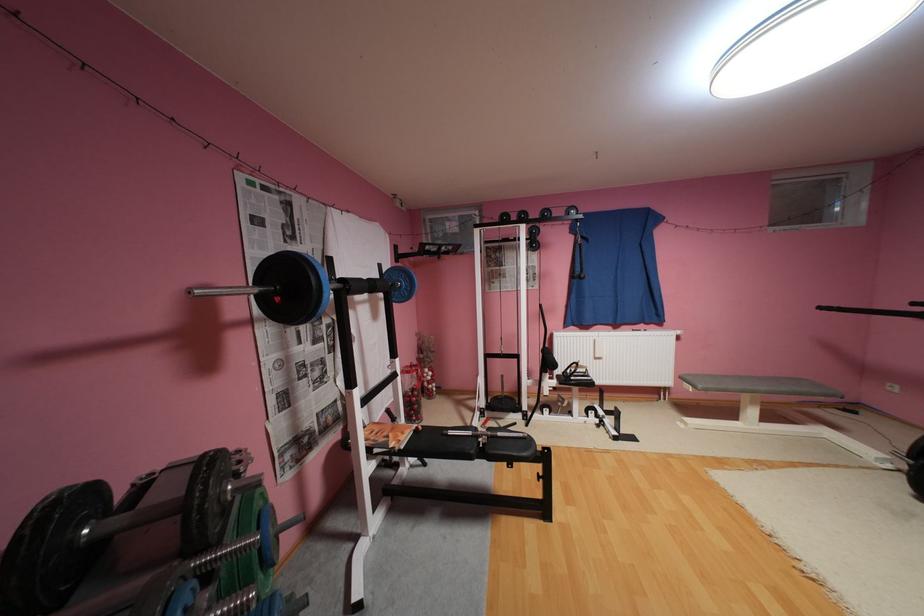
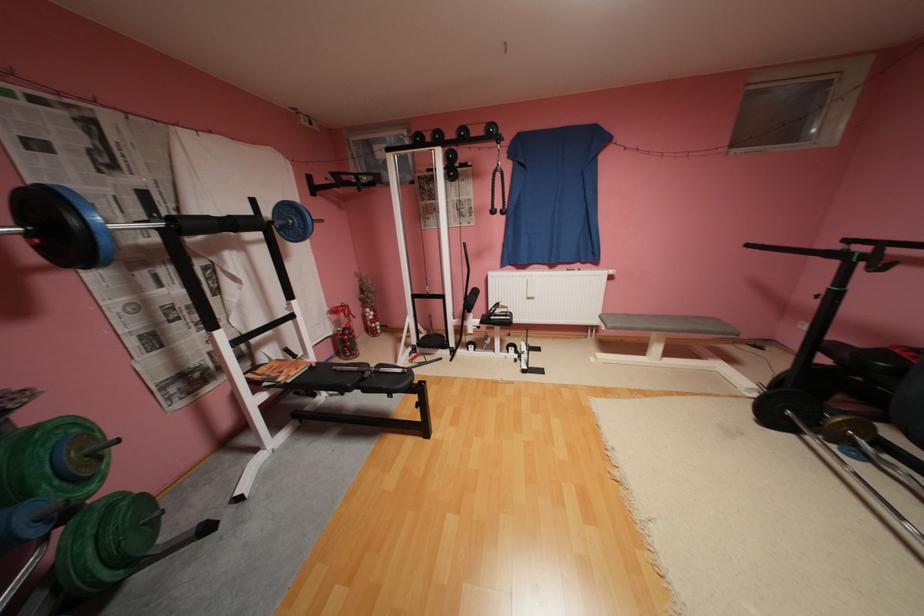
Question: The images are taken continuously from a first-person perspective. In which direction is your viewpoint rotating?

Choices:
 (A) Left
 (B) Right
 (C) Up
 (D) Down

Answer: (D)